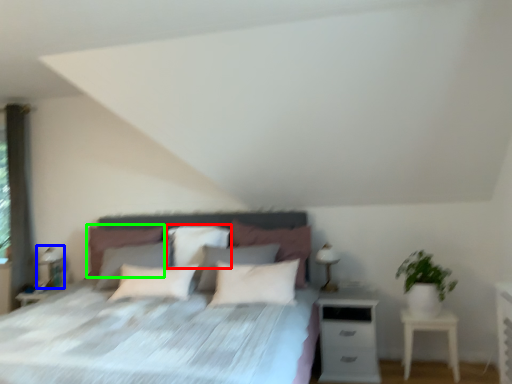
Question: Estimate the real-world distances between objects in this image. Which object is closer to pillow (highlighted by a red box), table lamp (highlighted by a blue box) or pillow (highlighted by a green box)?

Choices:
 (A) table lamp
 (B) pillow

Answer: (B)